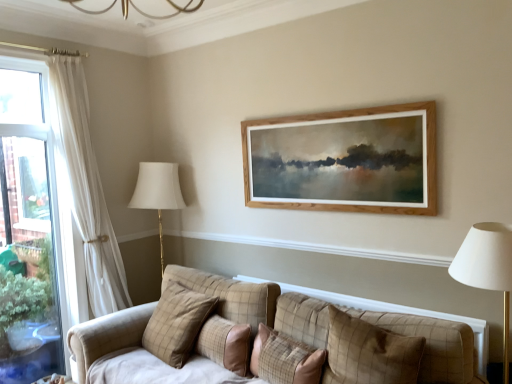
Question: Does plaid fabric pillow at center, the first pillow from the right, have a larger size compared to plaid fabric pillow at center, which is the second pillow from right to left?

Choices:
 (A) no
 (B) yes

Answer: (A)

Question: Does plaid fabric pillow at center, the first pillow from the right, have a greater height compared to plaid fabric pillow at center, the third pillow viewed from the left?

Choices:
 (A) no
 (B) yes

Answer: (B)

Question: From the image's perspective, is plaid fabric pillow at center, the first pillow from the right, below plaid fabric pillow at center, the third pillow viewed from the left?

Choices:
 (A) no
 (B) yes

Answer: (A)

Question: From a real-world perspective, is plaid fabric pillow at center, the first pillow from the right, on top of plaid fabric pillow at center, which is the second pillow from right to left?

Choices:
 (A) no
 (B) yes

Answer: (B)

Question: Are plaid fabric pillow at center, which ranks as the 4th pillow in left-to-right order, and plaid fabric pillow at center, which is the second pillow from right to left, far apart?

Choices:
 (A) yes
 (B) no

Answer: (B)

Question: Is plaid fabric pillow at center, the first pillow from the right, wider or thinner than plaid fabric pillow at center, the third pillow in the right-to-left sequence?

Choices:
 (A) thin
 (B) wide

Answer: (B)

Question: From the image's perspective, is plaid fabric pillow at center, the first pillow from the right, positioned above or below plaid fabric pillow at center, the second pillow when ordered from left to right?

Choices:
 (A) below
 (B) above

Answer: (B)

Question: Does point (389, 375) appear closer or farther from the camera than point (216, 350)?

Choices:
 (A) farther
 (B) closer

Answer: (B)

Question: Visually, is plaid fabric pillow at center, the first pillow from the right, positioned to the left or to the right of plaid fabric pillow at center, the third pillow in the right-to-left sequence?

Choices:
 (A) right
 (B) left

Answer: (A)

Question: From the image's perspective, is plaid fabric pillow at center, which is the second pillow from right to left, located above or below plaid fabric pillow at center, acting as the 1th pillow starting from the left?

Choices:
 (A) above
 (B) below

Answer: (B)

Question: In terms of width, does plaid fabric pillow at center, which is the second pillow from right to left, look wider or thinner when compared to plaid fabric pillow at center, which is counted as the fourth pillow, starting from the right?

Choices:
 (A) thin
 (B) wide

Answer: (A)

Question: Looking at the image, does plaid fabric pillow at center, which is the second pillow from right to left, seem bigger or smaller compared to plaid fabric pillow at center, which is counted as the fourth pillow, starting from the right?

Choices:
 (A) big
 (B) small

Answer: (B)

Question: In the image, is plaid fabric pillow at center, the third pillow viewed from the left, positioned in front of or behind plaid fabric pillow at center, acting as the 1th pillow starting from the left?

Choices:
 (A) front
 (B) behind

Answer: (A)

Question: From a real-world perspective, relative to plaid fabric pillow at center, the third pillow in the right-to-left sequence, is plaid fabric pillow at center, which is counted as the fourth pillow, starting from the right, vertically above or below?

Choices:
 (A) above
 (B) below

Answer: (A)

Question: In the image, is plaid fabric pillow at center, acting as the 1th pillow starting from the left, positioned in front of or behind plaid fabric pillow at center, the second pillow when ordered from left to right?

Choices:
 (A) behind
 (B) front

Answer: (A)